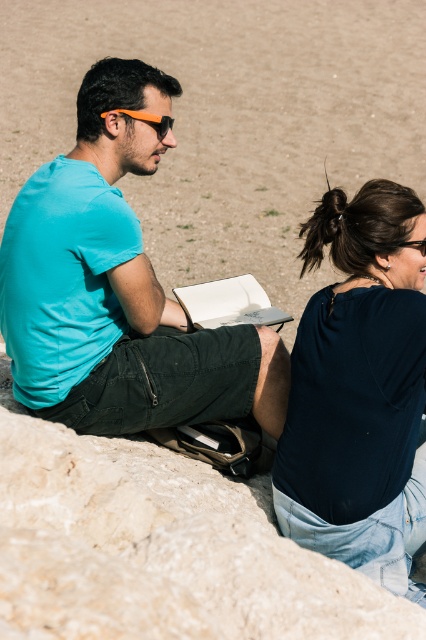
Which is behind, point (83, 384) or point (299, 540)?

The point (83, 384) is behind.

Does matte teal shirt at left have a larger size compared to dark blue fabric shirt at upper right?

Correct, matte teal shirt at left is larger in size than dark blue fabric shirt at upper right.

Is point (104, 192) positioned behind point (371, 326)?

That is True.

Where is `matte teal shirt at left`? matte teal shirt at left is located at coordinates (117, 288).

Can you confirm if dark blue fabric shirt at upper right is positioned above orange plastic goggles at left?

Incorrect, dark blue fabric shirt at upper right is not positioned above orange plastic goggles at left.

Between point (417, 237) and point (158, 131), which one is positioned behind?

Point (158, 131)

Identify the location of dark blue fabric shirt at upper right. The image size is (426, 640). (359, 390).

Between orange plastic goggles at left and orange matte goggles at upper center, which one is positioned lower?

orange matte goggles at upper center

Is point (166, 120) behind point (420, 250)?

Yes, it is behind point (420, 250).

Identify the location of orange plastic goggles at left. (149, 118).